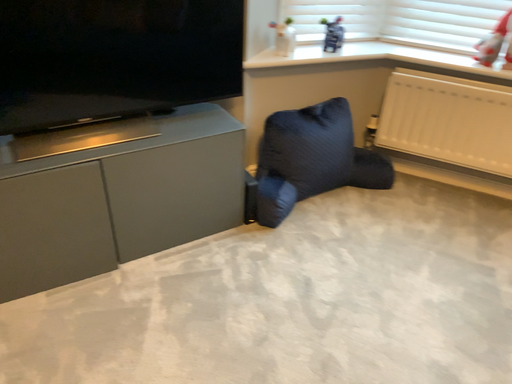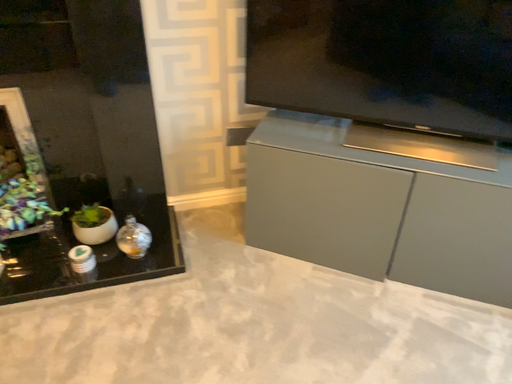
Question: Which way did the camera rotate in the video?

Choices:
 (A) rotated upward
 (B) rotated downward

Answer: (A)